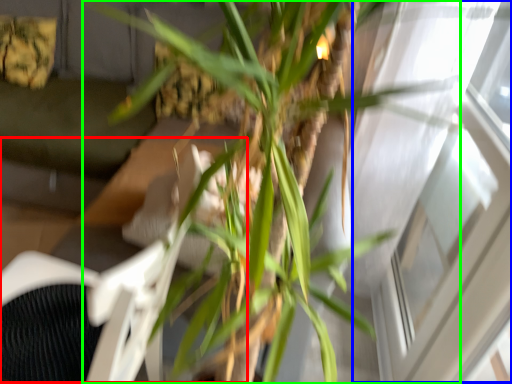
Question: Considering the real-world distances, which object is closest to swivel chair (highlighted by a red box)? window (highlighted by a blue box) or houseplant (highlighted by a green box).

Choices:
 (A) window
 (B) houseplant

Answer: (B)